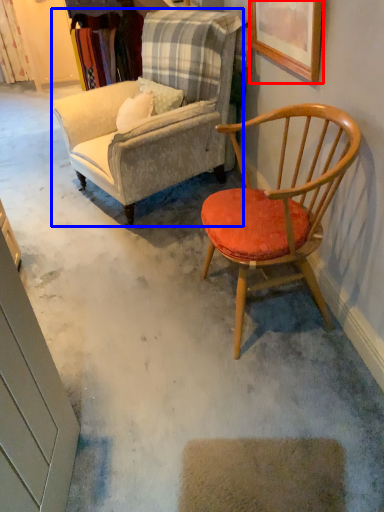
Question: Which object appears farthest to the camera in this image, picture frame (highlighted by a red box) or chair (highlighted by a blue box)?

Choices:
 (A) picture frame
 (B) chair

Answer: (B)